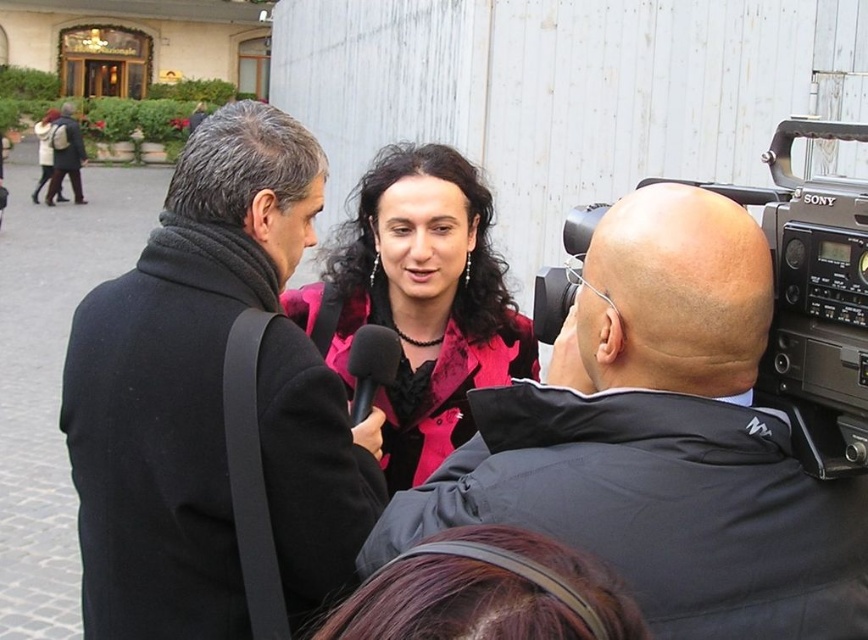
Looking at this image, can you confirm if black wool coat at left is thinner than black matte microphone at center?

In fact, black wool coat at left might be wider than black matte microphone at center.

Is black wool coat at left above black matte microphone at center?

Indeed, black wool coat at left is positioned over black matte microphone at center.

Locate an element on the screen. The width and height of the screenshot is (868, 640). black wool coat at left is located at coordinates (211, 401).

Where is `black wool coat at left`? Image resolution: width=868 pixels, height=640 pixels. black wool coat at left is located at coordinates (211, 401).

Which of these two, pink satin jacket at center or black matte microphone at center, stands shorter?

black matte microphone at center

Is pink satin jacket at center closer to the viewer compared to black matte microphone at center?

No.

Identify the location of pink satin jacket at center. (419, 300).

Locate an element on the screen. This screenshot has width=868, height=640. pink satin jacket at center is located at coordinates (419, 300).

Is point (450, 396) farther from camera compared to point (573, 253)?

That is True.

Is pink satin jacket at center bigger than black plastic camera at upper right?

Indeed, pink satin jacket at center has a larger size compared to black plastic camera at upper right.

Does point (491, 248) come behind point (807, 268)?

Yes.

Find the location of a particular element. This screenshot has height=640, width=868. pink satin jacket at center is located at coordinates (419, 300).